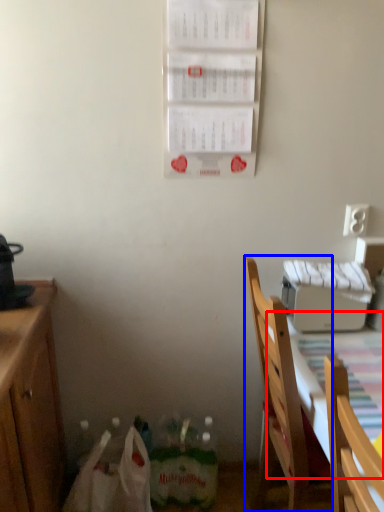
Question: Among these objects, which one is farthest to the camera, tablecloth (highlighted by a red box) or chair (highlighted by a blue box)?

Choices:
 (A) tablecloth
 (B) chair

Answer: (B)